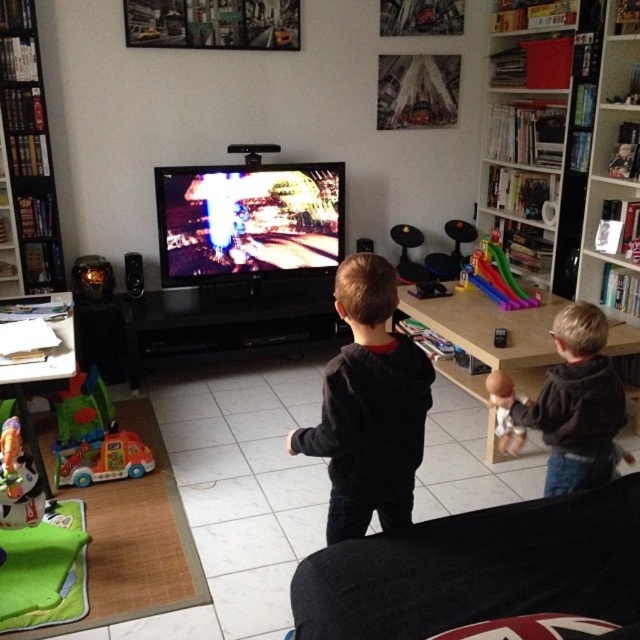
Question: Which object is the farthest from the translucent plastic slide at center?

Choices:
 (A) smooth beige doll at center
 (B) multicolored plastic toy truck at lower left

Answer: (B)

Question: Does dark gray hoodie at center appear over multicolored plastic toy truck at lower left?

Choices:
 (A) no
 (B) yes

Answer: (B)

Question: Does black plastic bookshelf at left appear under dark gray hoodie at center?

Choices:
 (A) no
 (B) yes

Answer: (A)

Question: Does dark gray sweater at center have a greater width compared to smooth beige doll at center?

Choices:
 (A) yes
 (B) no

Answer: (A)

Question: Which point is closer to the camera?

Choices:
 (A) black glossy entertainment center at center
 (B) black plastic bookshelf at left
 (C) smooth beige doll at center

Answer: (C)

Question: Among these objects, which one is nearest to the camera?

Choices:
 (A) smooth beige doll at center
 (B) dark gray hoodie at center

Answer: (B)